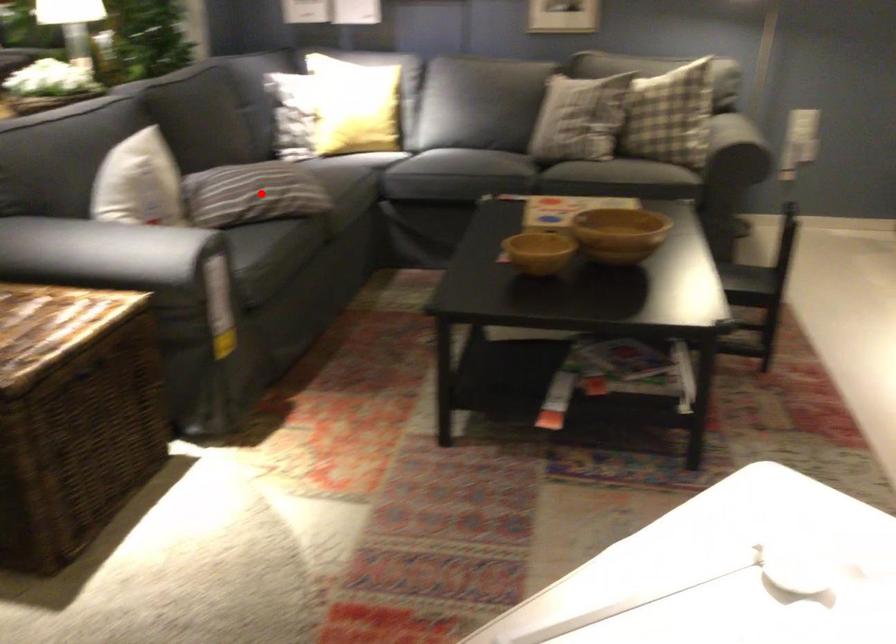
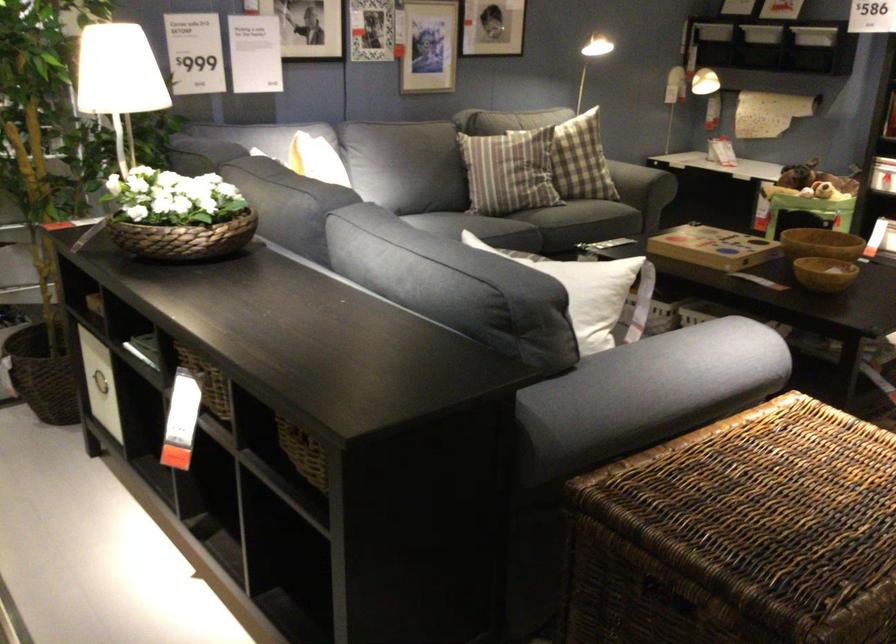
Question: I am providing you with two images of the same scene from different viewpoints. A red point is marked on the first image. Can you still see the location of the red point in image 2?

Choices:
 (A) Yes
 (B) No

Answer: (B)